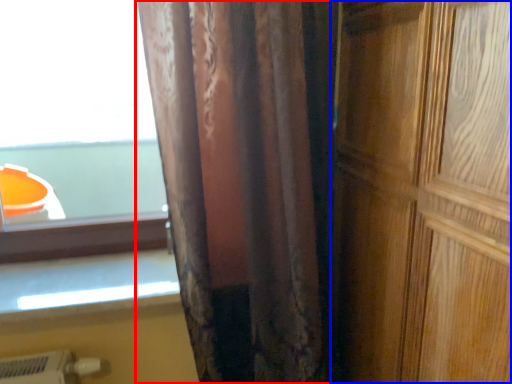
Question: Which object appears closest to the camera in this image, curtain (highlighted by a red box) or door (highlighted by a blue box)?

Choices:
 (A) curtain
 (B) door

Answer: (B)